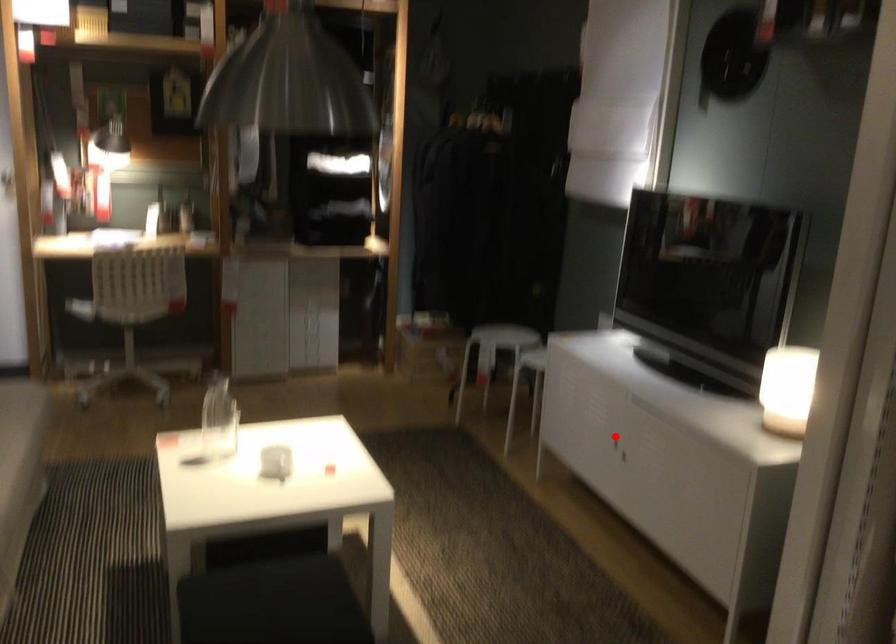
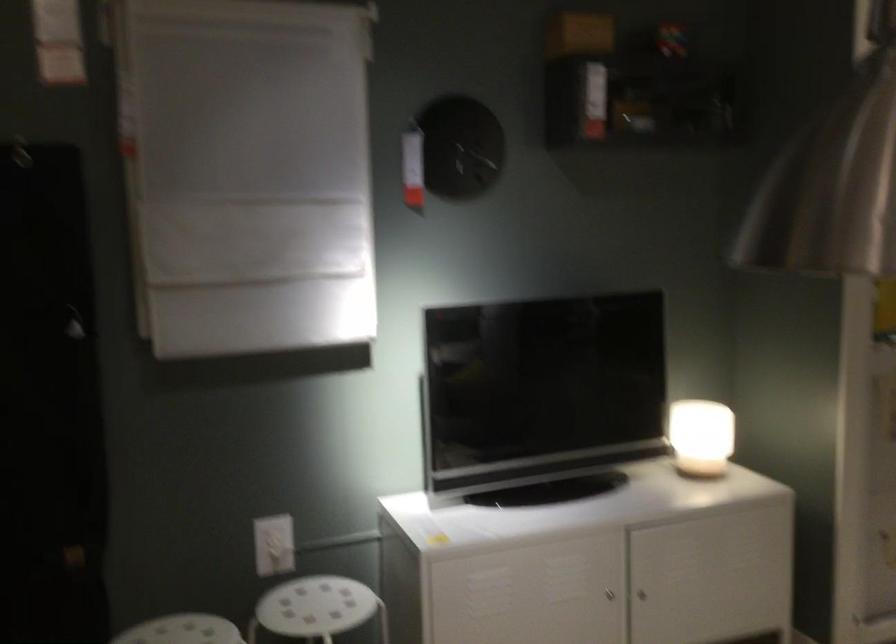
Where in the second image is the point corresponding to the highlighted location from the first image?

(608, 594)